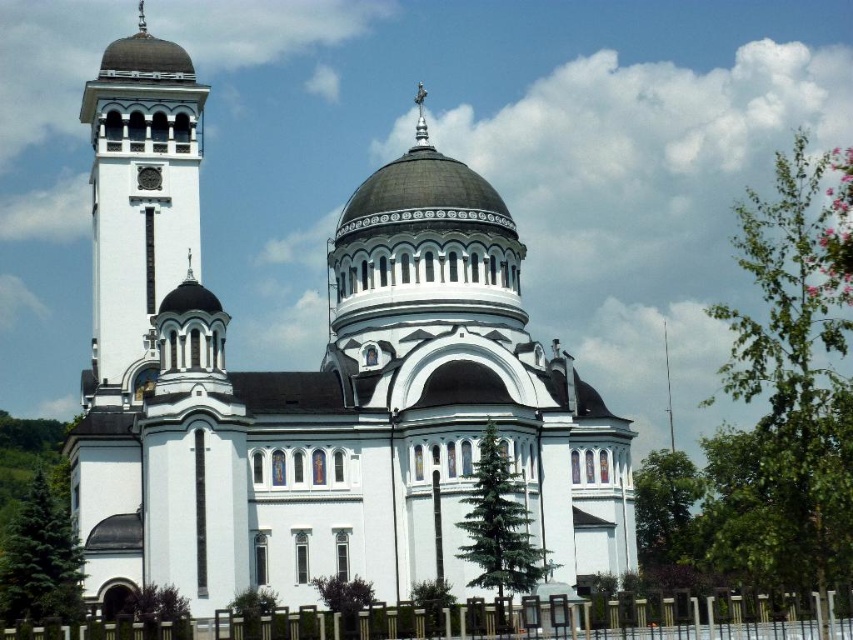
Question: Does white stone tower at left appear under white metal fence at lower center?

Choices:
 (A) yes
 (B) no

Answer: (B)

Question: Does white stone tower at left lie in front of white metal fence at lower center?

Choices:
 (A) no
 (B) yes

Answer: (A)

Question: Which of these objects is positioned farthest from the white stone tower at left?

Choices:
 (A) white stone church at center
 (B) white metal fence at lower center

Answer: (B)

Question: Which point appears closest to the camera in this image?

Choices:
 (A) (10, 632)
 (B) (109, 333)
 (C) (210, 392)

Answer: (A)

Question: Is white stone tower at left behind white metal fence at lower center?

Choices:
 (A) yes
 (B) no

Answer: (A)

Question: Which point appears closest to the camera in this image?

Choices:
 (A) click(x=582, y=408)
 (B) click(x=131, y=289)
 (C) click(x=850, y=637)

Answer: (C)